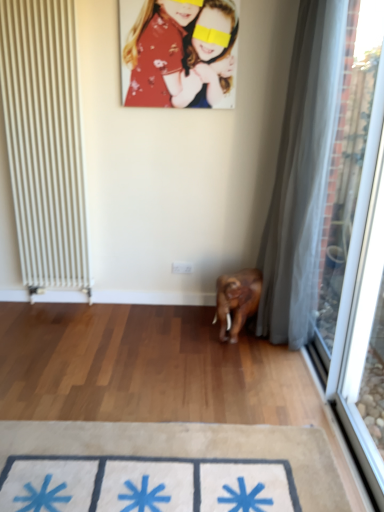
Where is `vacant space underneath floral fabric portrait at upper center (from a real-world perspective)`? vacant space underneath floral fabric portrait at upper center (from a real-world perspective) is located at coordinates (171, 300).